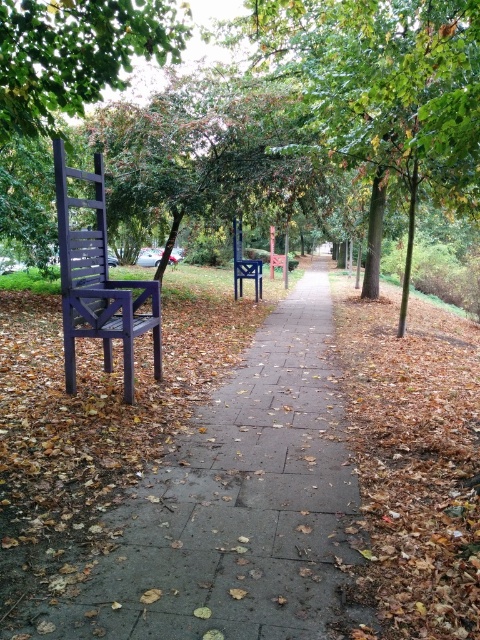
You are standing on the park pathway and want to sit on the matte purple chair at left. To your left, there is a green leafy tree at upper left. Which direction should you face to have the tree to your left while sitting on the chair?

You should face away from the tree so that the green leafy tree at upper left is to your left when sitting on the matte purple chair at left.

You are a park visitor trying to sit down. You see the smooth concrete pavement at center and the matte purple chair at left. Which surface is more likely to be cool to the touch on a sunny day?

The smooth concrete pavement at center is positioned under matte purple chair at left, so it is more likely to be cool to the touch on a sunny day because it is in a shaded area.